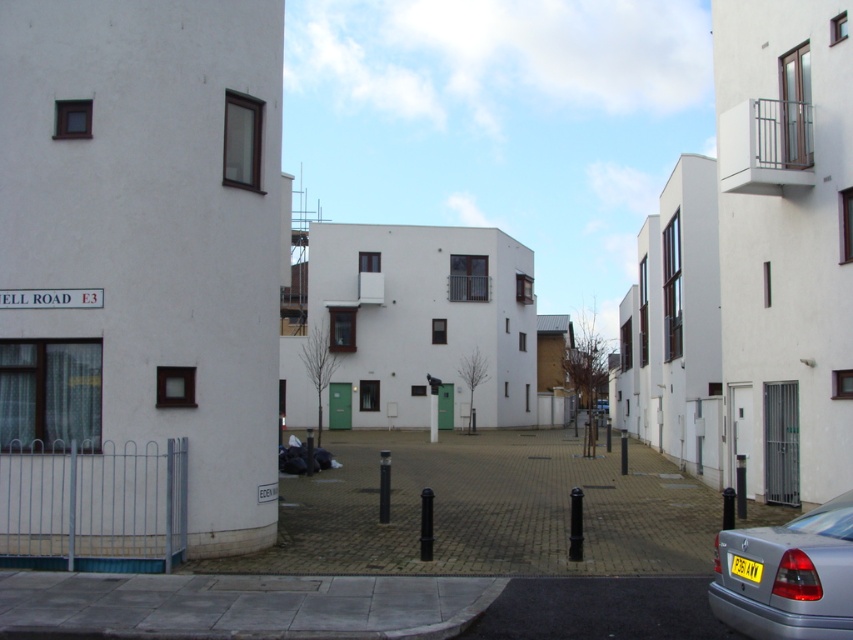
Is silver metallic car at lower right wider than yellow plastic license plate at lower right?

Correct, the width of silver metallic car at lower right exceeds that of yellow plastic license plate at lower right.

Measure the distance between silver metallic car at lower right and yellow plastic license plate at lower right.

6.93 inches

Image resolution: width=853 pixels, height=640 pixels. What are the coordinates of `silver metallic car at lower right` in the screenshot? It's located at (788, 577).